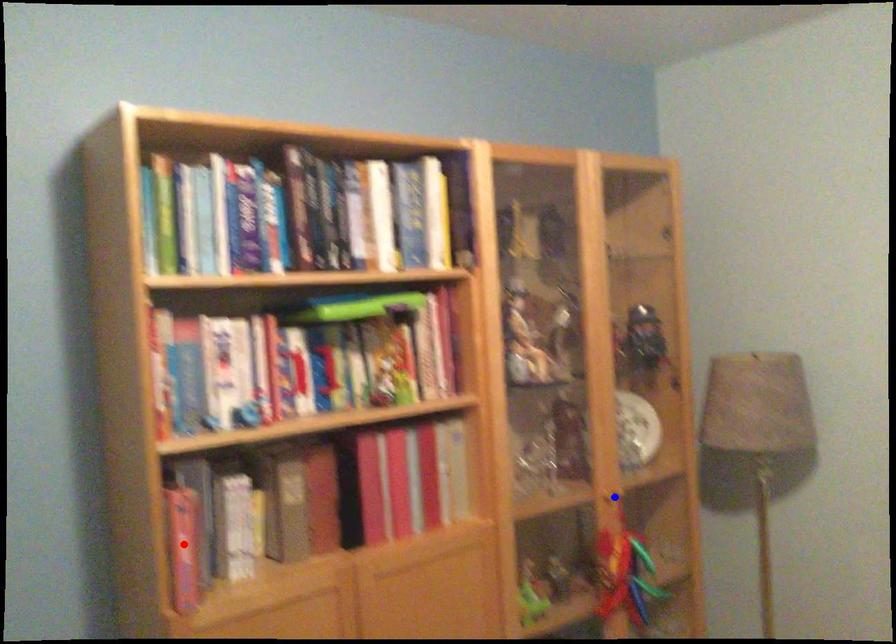
Question: In the image, two points are highlighted. Which point is nearer to the camera? Reply with the corresponding letter.

Choices:
 (A) blue point
 (B) red point

Answer: (B)